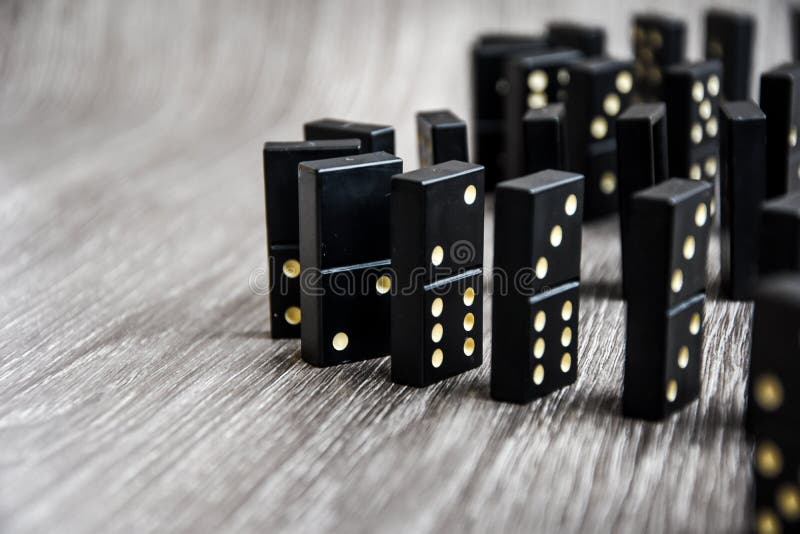
This screenshot has width=800, height=534. Find the location of `table`. table is located at coordinates (514, 493).